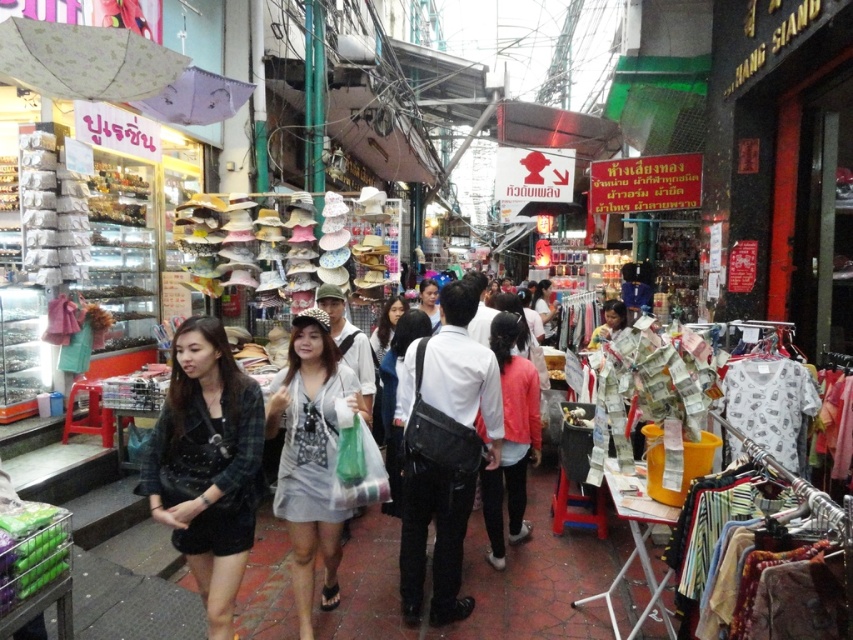
Looking at this image, you are a shopper at the market and want to buy both the polka dot dress at center and the matte white shirt at center. Which item is closer to you as you walk through the crowd?

The polka dot dress at center is closer to you since it is in front of the matte white shirt at center.

You are a delivery person carrying a box that is 3 meters long. You are standing at the camera position and want to place the box in front of the black fuzzy jacket at lower left. Can you fit the box without moving the jacket?

The distance between the black fuzzy jacket at lower left and the camera is 2.89 meters, which is shorter than the box length of 3 meters. Therefore, the box cannot be placed in front of the jacket without moving it.

You are a customer in the market looking to buy clothing items. You see a polka dot dress at center and a matte white shirt at center. Which item takes up more space in your shopping bag?

The polka dot dress at center is bigger than the matte white shirt at center, so it will take up more space in your shopping bag.